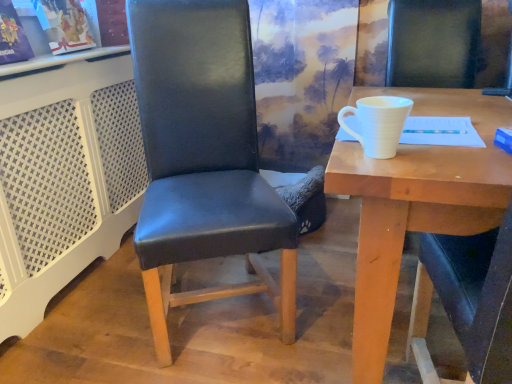
Where is `black leather chair at center`? The height and width of the screenshot is (384, 512). black leather chair at center is located at coordinates (203, 157).

You are a GUI agent. You are given a task and a screenshot of the screen. Output one action in this format:
    pyautogui.click(x=<x>, y=<y>)
    Task: Click on the white matte cup at upper right
    
    Given the screenshot: What is the action you would take?
    pyautogui.click(x=416, y=203)

Is white matte cup at upper right aimed at white matte cup at right?

No, white matte cup at upper right does not turn towards white matte cup at right.

How far apart are white matte cup at upper right and white matte cup at right?

white matte cup at upper right and white matte cup at right are 22.42 centimeters apart.

From the image's perspective, would you say white matte cup at upper right is shown under white matte cup at right?

Yes, from the image's perspective, white matte cup at upper right is below white matte cup at right.

Considering the relative sizes of white matte cup at upper right and white matte cup at right in the image provided, is white matte cup at upper right thinner than white matte cup at right?

No.

Would you say white matte cup at right is inside or outside white matte cup at upper right?

white matte cup at right is spatially situated outside white matte cup at upper right.

Would you say white matte cup at right is a long distance from white matte cup at upper right?

Actually, white matte cup at right and white matte cup at upper right are a little close together.

From the picture: Measure the distance from white matte cup at right to white matte cup at upper right.

The distance of white matte cup at right from white matte cup at upper right is 8.83 inches.

Between white matte cup at right and white matte cup at upper right, which one has less height?

white matte cup at right.

Is point (180, 229) closer to camera compared to point (487, 111)?

That is False.

Looking at this image, between black leather chair at center and white matte cup at upper right, which one has smaller size?

Smaller between the two is black leather chair at center.

From a real-world perspective, between black leather chair at center and white matte cup at upper right, who is vertically lower?

From a 3D spatial view, white matte cup at upper right is below.

Between black leather chair at center and white matte cup at upper right, which one appears on the left side from the viewer's perspective?

From the viewer's perspective, black leather chair at center appears more on the left side.

Is white matte cup at upper right to the left of black leather chair at center from the viewer's perspective?

In fact, white matte cup at upper right is to the right of black leather chair at center.

This screenshot has height=384, width=512. I want to click on chair lying behind the white matte cup at upper right, so click(203, 157).

Who is shorter, white matte cup at upper right or black leather chair at center?

With less height is white matte cup at upper right.

Which of these two, white matte cup at upper right or black leather chair at center, is bigger?

Bigger between the two is white matte cup at upper right.

Who is shorter, black leather chair at center or white matte cup at right?

With less height is white matte cup at right.

From the image's perspective, is black leather chair at center on top of white matte cup at right?

No.

From a real-world perspective, is black leather chair at center beneath white matte cup at right?

Yes, from a real-world perspective, black leather chair at center is beneath white matte cup at right.

From a real-world perspective, is white matte cup at right beneath black leather chair at center?

Actually, white matte cup at right is physically above black leather chair at center in the real world.

Is there a large distance between white matte cup at right and black leather chair at center?

white matte cup at right is near black leather chair at center, not far away.

Is white matte cup at right oriented away from black leather chair at center?

No, white matte cup at right's orientation is not away from black leather chair at center.

Between white matte cup at right and black leather chair at center, which one appears on the left side from the viewer's perspective?

black leather chair at center is more to the left.

Where is `desk beneath the white matte cup at right (from a real-world perspective)`? This screenshot has height=384, width=512. desk beneath the white matte cup at right (from a real-world perspective) is located at coordinates (416, 203).

This screenshot has width=512, height=384. In order to click on desk lying on the right of white matte cup at right in this screenshot , I will do `click(416, 203)`.

Which object lies further to the anchor point white matte cup at upper right, black leather chair at center or white matte cup at right?

Among the two, black leather chair at center is located further to white matte cup at upper right.

When comparing their distances from black leather chair at center, does white matte cup at right or white matte cup at upper right seem further?

white matte cup at right.

Based on their spatial positions, is white matte cup at upper right or black leather chair at center further from white matte cup at right?

Based on the image, black leather chair at center appears to be further to white matte cup at right.

Based on their spatial positions, is white matte cup at upper right or white matte cup at right further from black leather chair at center?

white matte cup at right lies further to black leather chair at center than the other object.

Which object lies nearer to the anchor point white matte cup at upper right, white matte cup at right or black leather chair at center?

The object closer to white matte cup at upper right is white matte cup at right.

Based on their spatial positions, is black leather chair at center or white matte cup at upper right further from white matte cup at right?

black leather chair at center is positioned further to the anchor white matte cup at right.

This screenshot has height=384, width=512. I want to click on coffee cup between black leather chair at center and white matte cup at upper right from left to right, so click(378, 123).